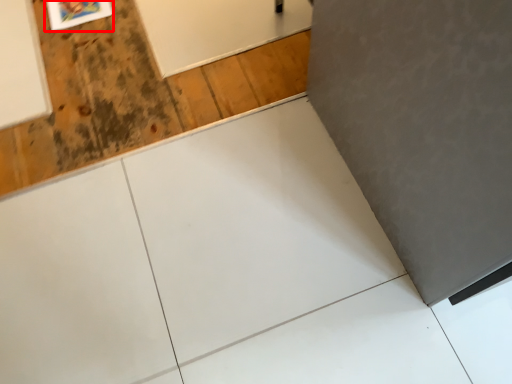
Question: From the image's perspective, what is the correct spatial positioning of picture frame (annotated by the red box) in reference to plywood?

Choices:
 (A) below
 (B) above

Answer: (B)